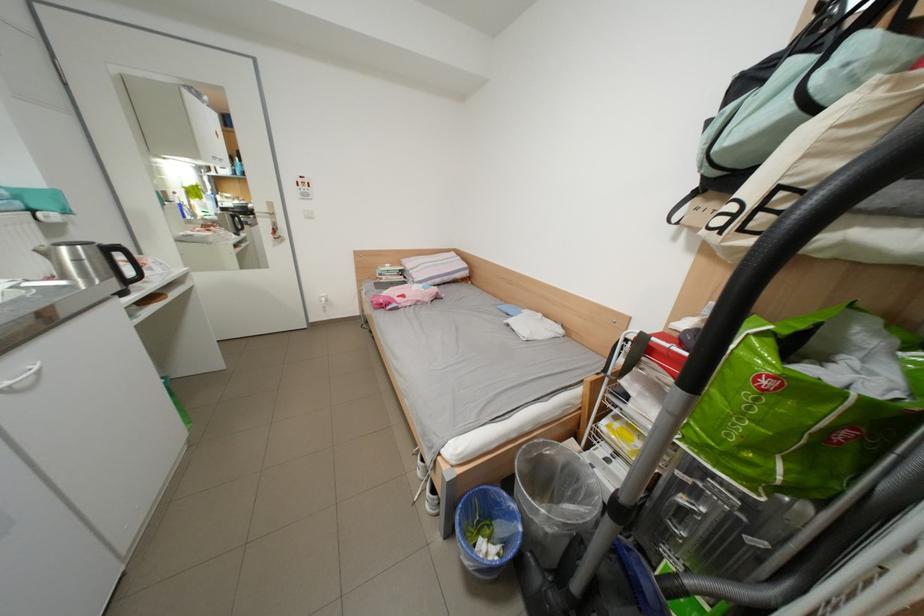
Find the location of a particular element. The height and width of the screenshot is (616, 924). silver door handle is located at coordinates (79, 461).